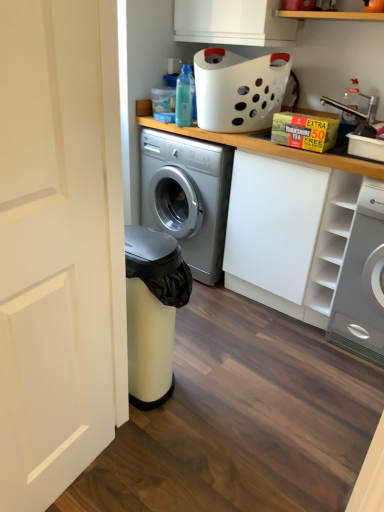
Question: Is white matte door at left in contact with white glossy washing machine at right?

Choices:
 (A) yes
 (B) no

Answer: (B)

Question: From the image's perspective, is white matte door at left above white glossy washing machine at right?

Choices:
 (A) no
 (B) yes

Answer: (A)

Question: Considering the relative sizes of white matte door at left and white glossy washing machine at right in the image provided, is white matte door at left bigger than white glossy washing machine at right?

Choices:
 (A) no
 (B) yes

Answer: (A)

Question: Can you confirm if white matte door at left is thinner than white glossy washing machine at right?

Choices:
 (A) no
 (B) yes

Answer: (B)

Question: Considering the relative sizes of white matte door at left and white glossy washing machine at right in the image provided, is white matte door at left shorter than white glossy washing machine at right?

Choices:
 (A) no
 (B) yes

Answer: (A)

Question: Would you consider white matte door at left to be distant from white glossy washing machine at right?

Choices:
 (A) yes
 (B) no

Answer: (A)

Question: Is white matte cabinet at upper right oriented towards translucent plastic bottle at upper center?

Choices:
 (A) yes
 (B) no

Answer: (B)

Question: Does white matte cabinet at upper right appear on the left side of translucent plastic bottle at upper center?

Choices:
 (A) yes
 (B) no

Answer: (B)

Question: From a real-world perspective, is white matte cabinet at upper right over translucent plastic bottle at upper center?

Choices:
 (A) yes
 (B) no

Answer: (B)

Question: Does white matte cabinet at upper right lie behind translucent plastic bottle at upper center?

Choices:
 (A) yes
 (B) no

Answer: (B)

Question: Does white matte cabinet at upper right have a lesser width compared to translucent plastic bottle at upper center?

Choices:
 (A) yes
 (B) no

Answer: (B)

Question: Can we say white matte cabinet at upper right lies outside translucent plastic bottle at upper center?

Choices:
 (A) yes
 (B) no

Answer: (A)

Question: Is white matte cabinet at upper right at the left side of white matte cabinet at upper right?

Choices:
 (A) yes
 (B) no

Answer: (A)